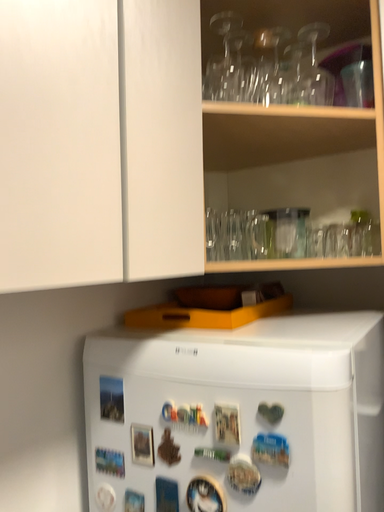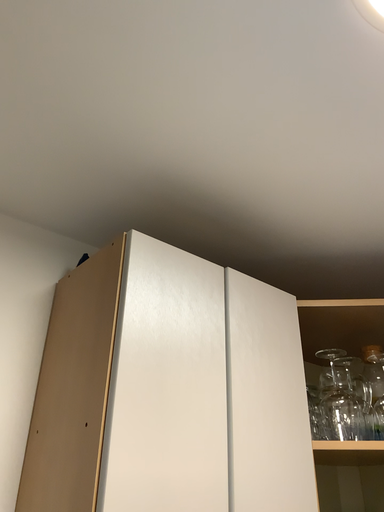
Question: How did the camera likely rotate when shooting the video?

Choices:
 (A) rotated left
 (B) rotated right

Answer: (A)